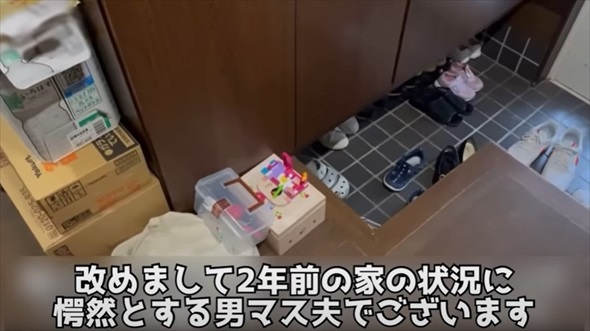
Find the location of a particular element. tiled floor is located at coordinates (504, 111).